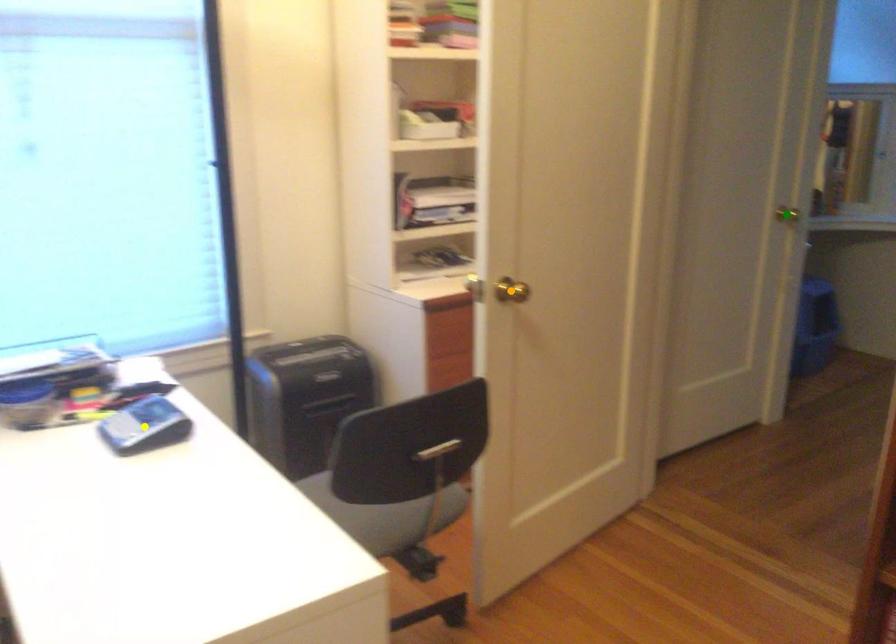
Order these from farthest to nearest:
orange point
green point
yellow point

green point → orange point → yellow point